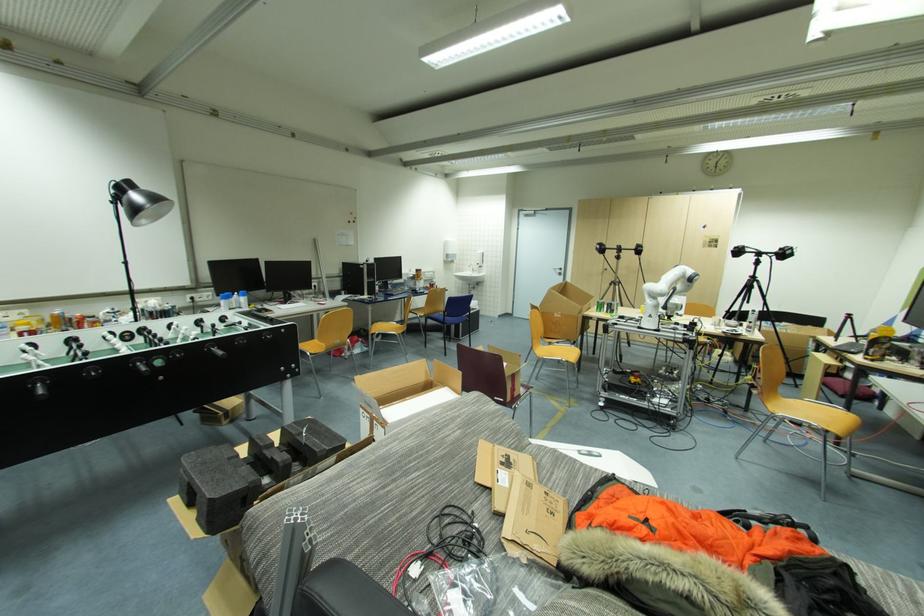
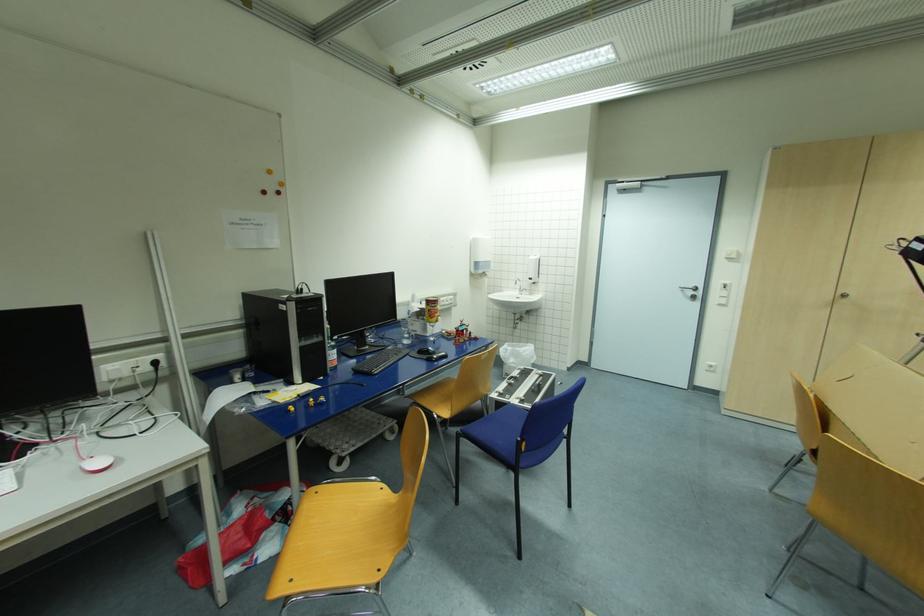
The point at (564, 270) is marked in the first image. Where is the corresponding point in the second image?

(699, 289)